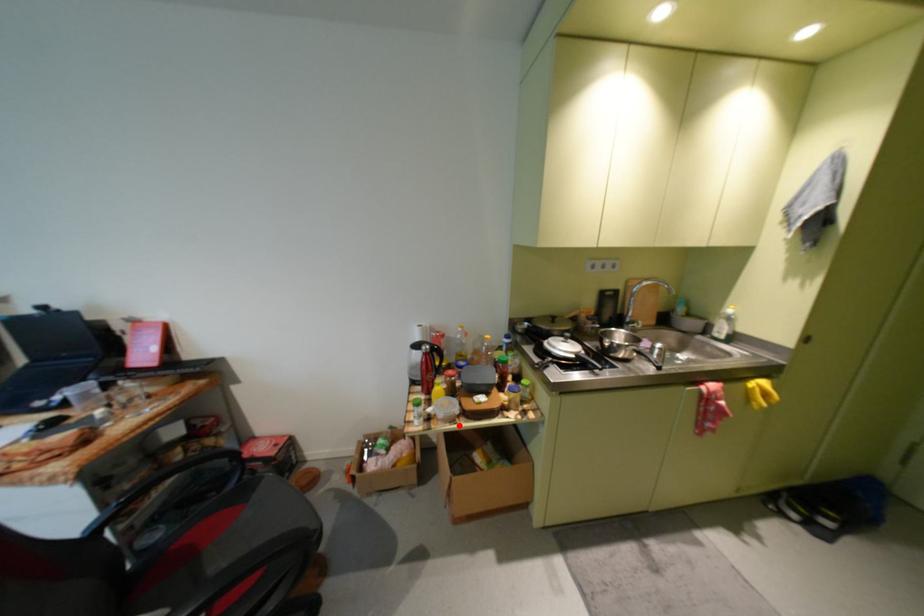
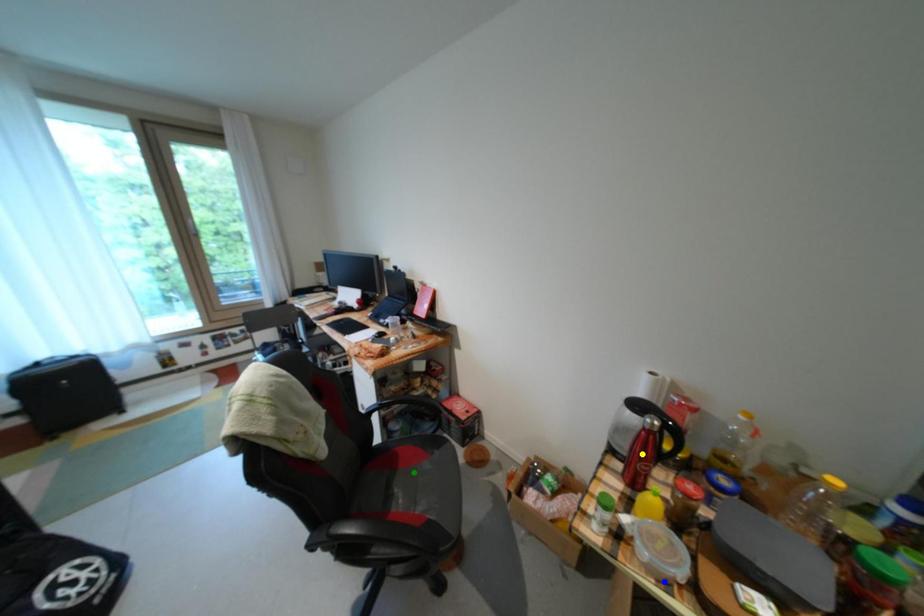
Question: I am providing you with two images of the same scene from different viewpoints. A red point is marked on the first image. You are given multiple points on the second image. Can you choose the point in image 2 that corresponds to the point in image 1?

Choices:
 (A) yellow point
 (B) blue point
 (C) green point

Answer: (B)